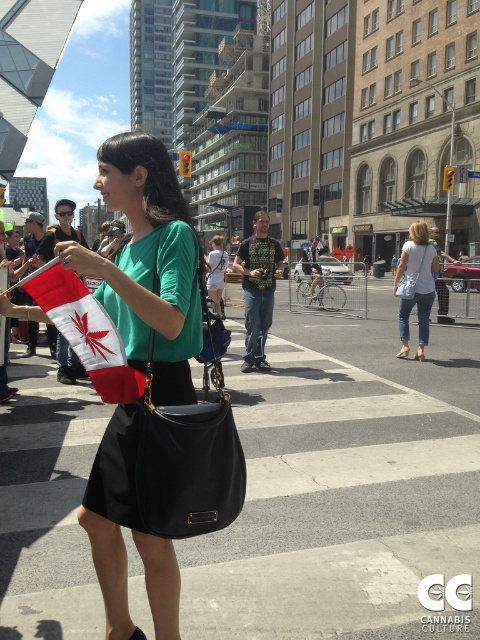
Question: Considering the real-world distances, which object is farthest from the white denim jeans at center?

Choices:
 (A) black leather bag at center
 (B) black leather handbag at center
 (C) white matte shorts at center
 (D) matte black bag at center

Answer: (D)

Question: Can you confirm if white matte shorts at center is bigger than black leather bag at center?

Choices:
 (A) no
 (B) yes

Answer: (B)

Question: Can you confirm if matte black bag at center is thinner than black leather handbag at center?

Choices:
 (A) no
 (B) yes

Answer: (A)

Question: Is red fabric flag at center closer to the viewer compared to white denim jeans at center?

Choices:
 (A) no
 (B) yes

Answer: (B)

Question: Which of these objects is positioned farthest from the red fabric flag at center?

Choices:
 (A) white matte shorts at center
 (B) black leather bag at center

Answer: (B)

Question: Which object appears farthest from the camera in this image?

Choices:
 (A) white denim jeans at center
 (B) black leather handbag at center

Answer: (A)